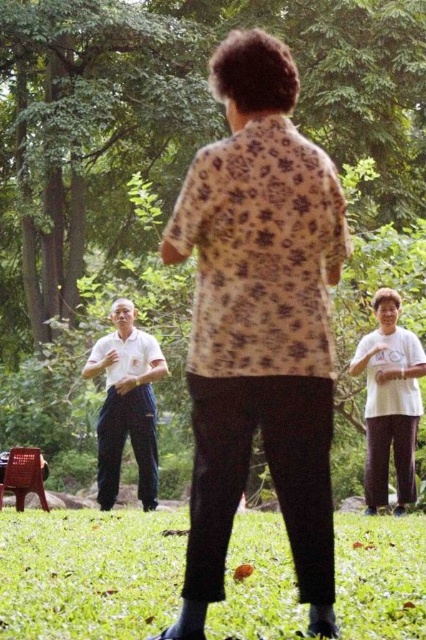
Does green grass at lower center have a greater height compared to white matte t-shirt at center?

No, green grass at lower center is not taller than white matte t-shirt at center.

Consider the image. Who is shorter, green grass at lower center or white matte t-shirt at center?

Standing shorter between the two is green grass at lower center.

Does point (83, 611) come farther from viewer compared to point (365, 344)?

That is False.

You are a GUI agent. You are given a task and a screenshot of the screen. Output one action in this format:
    pyautogui.click(x=<x>, y=<y>)
    Task: Click on the green grass at lower center
    This screenshot has width=426, height=640.
    Given the screenshot: What is the action you would take?
    pyautogui.click(x=89, y=573)

Does floral-patterned shirt at center come in front of white smooth shirt at left?

That is True.

Who is lower down, floral-patterned shirt at center or white smooth shirt at left?

white smooth shirt at left

Image resolution: width=426 pixels, height=640 pixels. What do you see at coordinates (259, 324) in the screenshot?
I see `floral-patterned shirt at center` at bounding box center [259, 324].

You are a GUI agent. You are given a task and a screenshot of the screen. Output one action in this format:
    pyautogui.click(x=<x>, y=<y>)
    Task: Click on the floral-patterned shirt at center
    The height and width of the screenshot is (640, 426).
    Given the screenshot: What is the action you would take?
    pyautogui.click(x=259, y=324)

Locate an element on the screen. The image size is (426, 640). floral-patterned shirt at center is located at coordinates (259, 324).

Does floral-patterned shirt at center have a smaller size compared to white matte t-shirt at center?

Yes, floral-patterned shirt at center is smaller than white matte t-shirt at center.

Where is `floral-patterned shirt at center`? floral-patterned shirt at center is located at coordinates (259, 324).